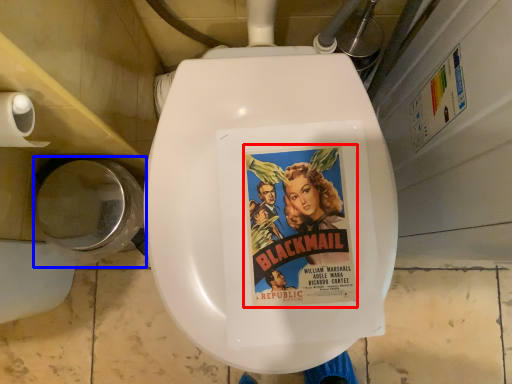
Question: Which point is closer to the camera, movie poster (highlighted by a red box) or toilet bowl (highlighted by a blue box)?

Choices:
 (A) movie poster
 (B) toilet bowl

Answer: (A)